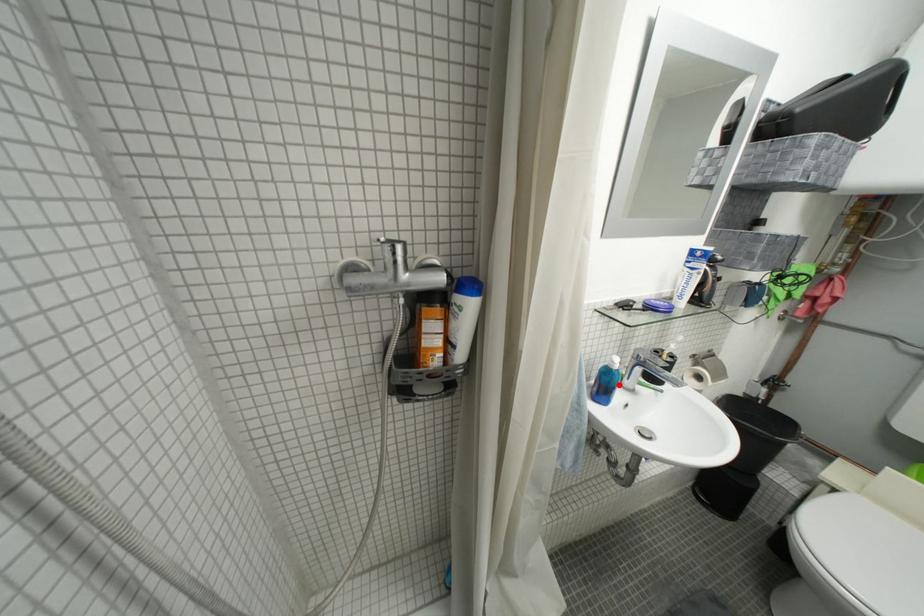
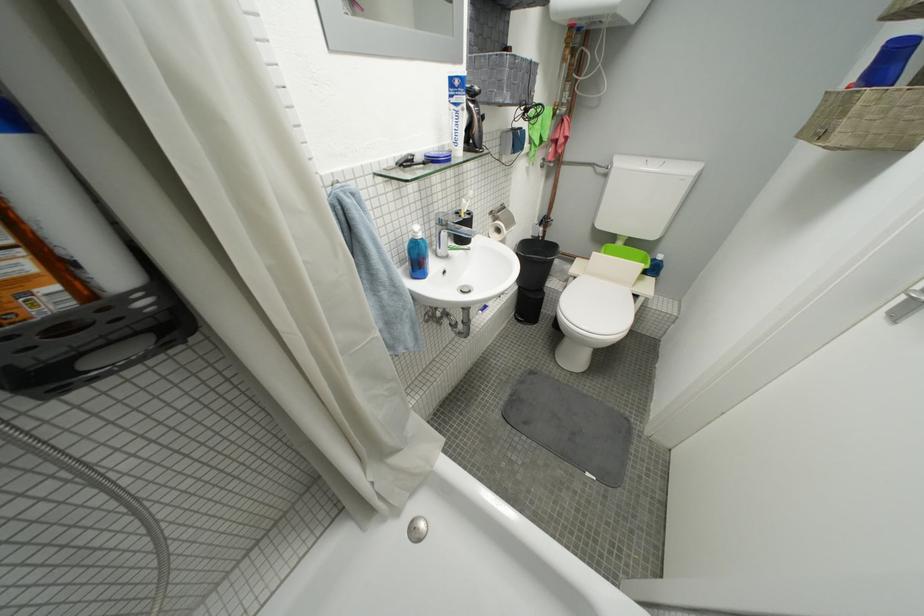
Locate, in the second image, the point that corresponds to the highlighted location in the first image.

(428, 257)